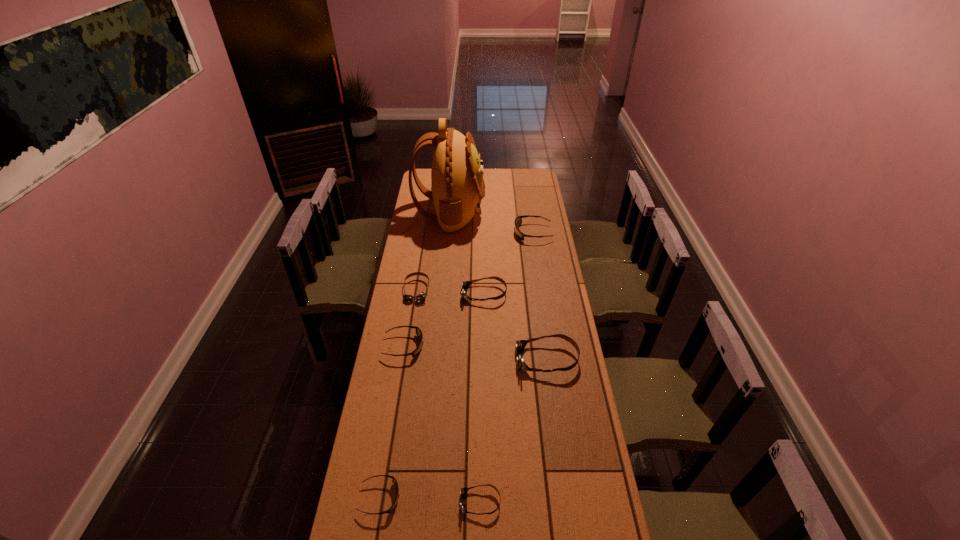
At what (x,y) coordinates should I click in order to perform the action: click on vacant space that satisfies the following two spatial constraints: 1. on the front-facing side of the leftmost brown goggles; 2. on the lenses of the second farthest black goggles. Please return your answer as a coordinate pair (x, y). The width and height of the screenshot is (960, 540). Looking at the image, I should click on 408,346.